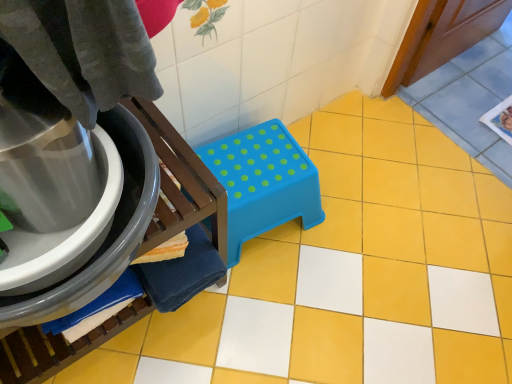
Question: Should I look upward or downward to see blue plastic stool at center?

Choices:
 (A) down
 (B) up

Answer: (A)

Question: Can you confirm if blue plastic stool at center is positioned to the left of blue plastic step stool at center?

Choices:
 (A) yes
 (B) no

Answer: (A)

Question: From the image's perspective, is blue plastic stool at center under blue plastic step stool at center?

Choices:
 (A) no
 (B) yes

Answer: (B)

Question: Does blue plastic stool at center have a greater width compared to blue plastic step stool at center?

Choices:
 (A) yes
 (B) no

Answer: (A)

Question: Does blue plastic stool at center contain blue plastic step stool at center?

Choices:
 (A) no
 (B) yes

Answer: (A)

Question: Is blue plastic stool at center not near blue plastic step stool at center?

Choices:
 (A) no
 (B) yes

Answer: (A)

Question: Is blue plastic stool at center taller than blue plastic step stool at center?

Choices:
 (A) yes
 (B) no

Answer: (A)

Question: Does blue plastic step stool at center have a larger size compared to blue plastic stool at center?

Choices:
 (A) yes
 (B) no

Answer: (B)

Question: Is blue plastic stool at center a part of blue plastic step stool at center?

Choices:
 (A) yes
 (B) no

Answer: (B)

Question: Is blue plastic step stool at center next to blue plastic stool at center?

Choices:
 (A) no
 (B) yes

Answer: (A)

Question: Is the position of blue plastic step stool at center more distant than that of blue plastic stool at center?

Choices:
 (A) no
 (B) yes

Answer: (B)

Question: Would you say blue plastic step stool at center is a long distance from blue plastic stool at center?

Choices:
 (A) yes
 (B) no

Answer: (B)

Question: From the image's perspective, does blue plastic step stool at center appear higher than blue plastic stool at center?

Choices:
 (A) yes
 (B) no

Answer: (A)

Question: Considering their positions, is blue plastic step stool at center located in front of or behind blue plastic stool at center?

Choices:
 (A) front
 (B) behind

Answer: (B)